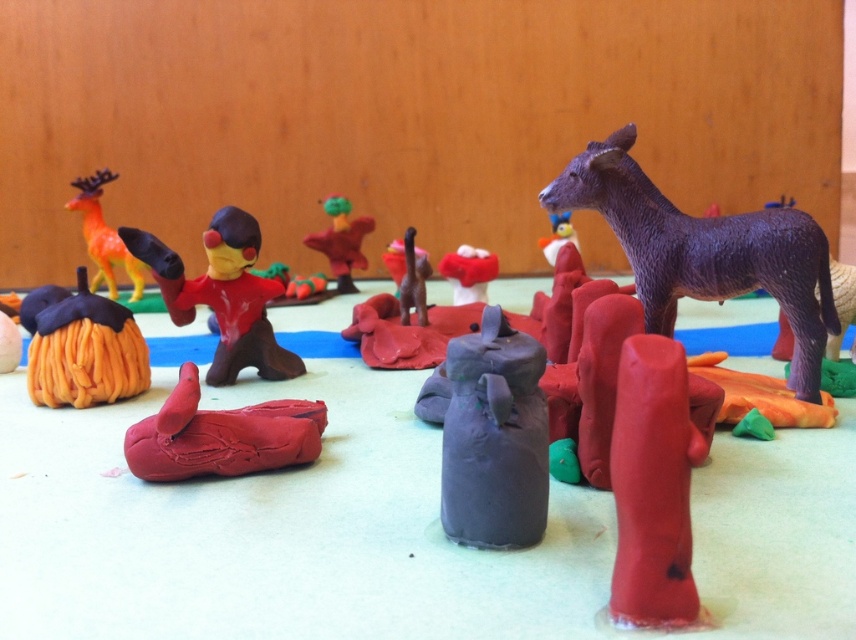
You are a tiny explorer in this clay diorama. You want to travel from the purple matte donkey at upper right to the matte red mushroom at center. Which direction should you move to get closer to the mushroom?

Since the purple matte donkey at upper right is closer to the viewer than the matte red mushroom at center, you should move backward to get closer to the matte red mushroom at center.

You are an artist working on a clay sculpture and need to place a new object at the coordinates point (705, 252). According to the scene, what object is already located there?

The point (705, 252) corresponds to the purple matte donkey at upper right.

You are a character in this clay scene needing to reach the top of the purple donkey. Which object, the rubberized red stick at center or the matte plastic figure at center, would you choose to stand on to reach higher?

The matte plastic figure at center is taller than the rubberized red stick at center, so standing on it would provide a better chance to reach the top of the purple donkey.